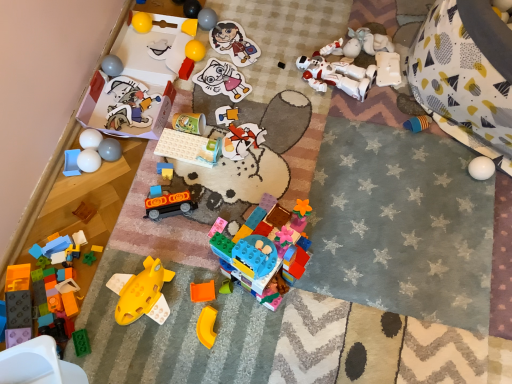
Locate an element on the screen. The height and width of the screenshot is (384, 512). free space to the right of matte plastic sticker at upper center, which is the 20th toy from left to right is located at coordinates (281, 48).